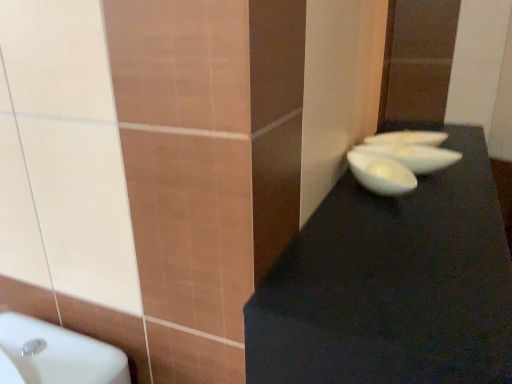
Question: From the image's perspective, is white glossy bowl at center right below white glossy bowl at upper right, the second basin in the front-to-back sequence?

Choices:
 (A) yes
 (B) no

Answer: (A)

Question: Would you consider white glossy bowl at center right to be distant from white glossy bowl at upper right, positioned as the first basin in back-to-front order?

Choices:
 (A) yes
 (B) no

Answer: (B)

Question: Is white glossy bowl at center right aimed at white glossy bowl at upper right, positioned as the first basin in back-to-front order?

Choices:
 (A) yes
 (B) no

Answer: (B)

Question: Is white glossy bowl at center right turned away from white glossy bowl at upper right, the second basin in the front-to-back sequence?

Choices:
 (A) no
 (B) yes

Answer: (A)

Question: From a real-world perspective, is white glossy bowl at center right on top of white glossy bowl at upper right, the second basin in the front-to-back sequence?

Choices:
 (A) yes
 (B) no

Answer: (B)

Question: From a real-world perspective, is white glossy bowl at center right beneath white glossy bowl at upper right, the second basin in the front-to-back sequence?

Choices:
 (A) yes
 (B) no

Answer: (A)

Question: Can you confirm if white glossy bowl at upper right, positioned as the first basin in back-to-front order, is bigger than white glossy bowl at center, the 2th basin in the back-to-front sequence?

Choices:
 (A) yes
 (B) no

Answer: (B)

Question: Is white glossy bowl at upper right, the second basin in the front-to-back sequence, behind white glossy bowl at center, the 2th basin in the back-to-front sequence?

Choices:
 (A) yes
 (B) no

Answer: (A)

Question: Can you confirm if white glossy bowl at upper right, positioned as the first basin in back-to-front order, is smaller than white glossy bowl at center, the 2th basin in the back-to-front sequence?

Choices:
 (A) no
 (B) yes

Answer: (B)

Question: Is white glossy bowl at upper right, positioned as the first basin in back-to-front order, oriented towards white glossy bowl at center, the 2th basin in the back-to-front sequence?

Choices:
 (A) yes
 (B) no

Answer: (B)

Question: From a real-world perspective, is white glossy bowl at upper right, the second basin in the front-to-back sequence, positioned over white glossy bowl at center, the first basin viewed from the front, based on gravity?

Choices:
 (A) yes
 (B) no

Answer: (A)

Question: Is white glossy bowl at center, the 2th basin in the back-to-front sequence, inside white glossy bowl at upper right, the second basin in the front-to-back sequence?

Choices:
 (A) yes
 (B) no

Answer: (B)

Question: Considering the relative sizes of white glossy bowl at center, the 2th basin in the back-to-front sequence, and white glossy bowl at center right in the image provided, is white glossy bowl at center, the 2th basin in the back-to-front sequence, bigger than white glossy bowl at center right?

Choices:
 (A) yes
 (B) no

Answer: (B)